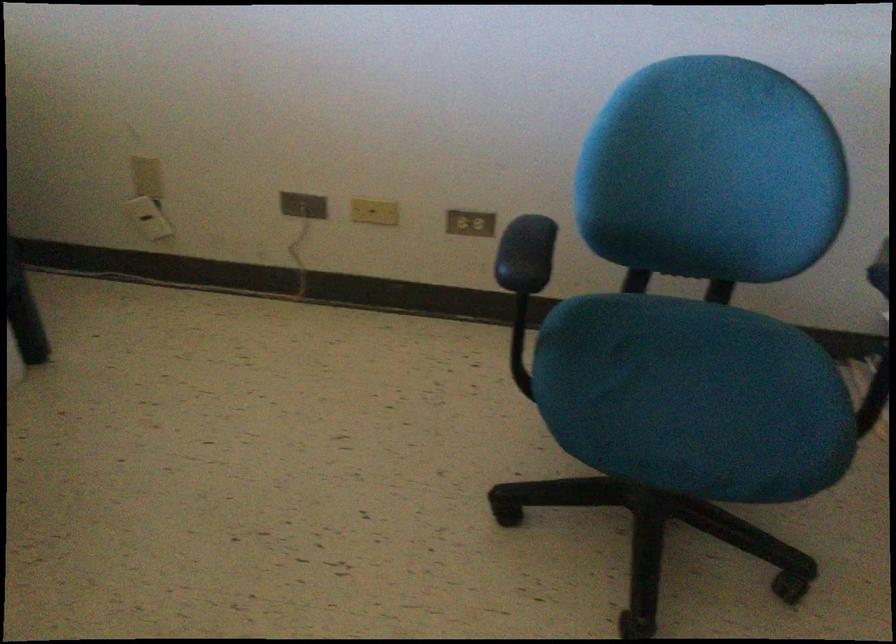
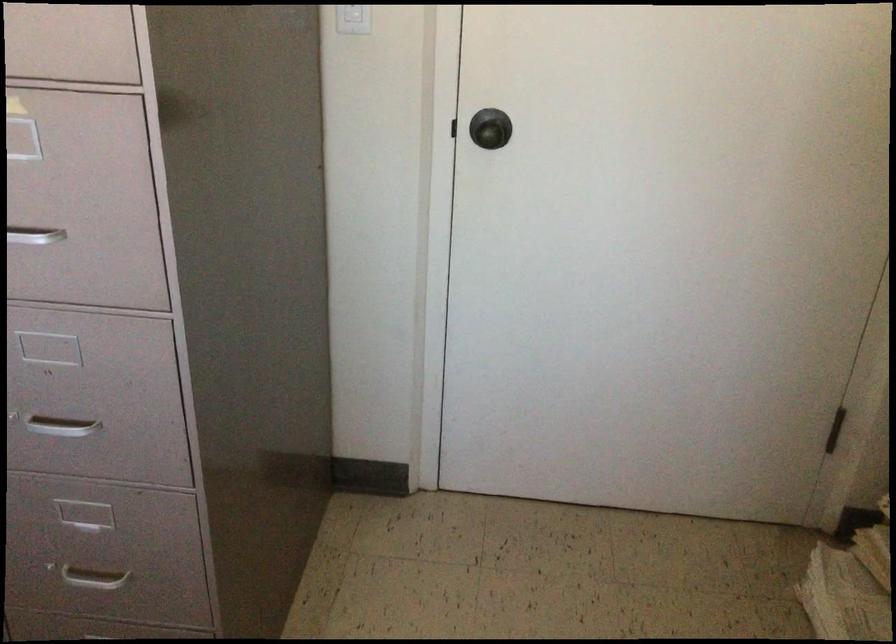
How did the camera likely rotate?

The camera rotated toward right-down.